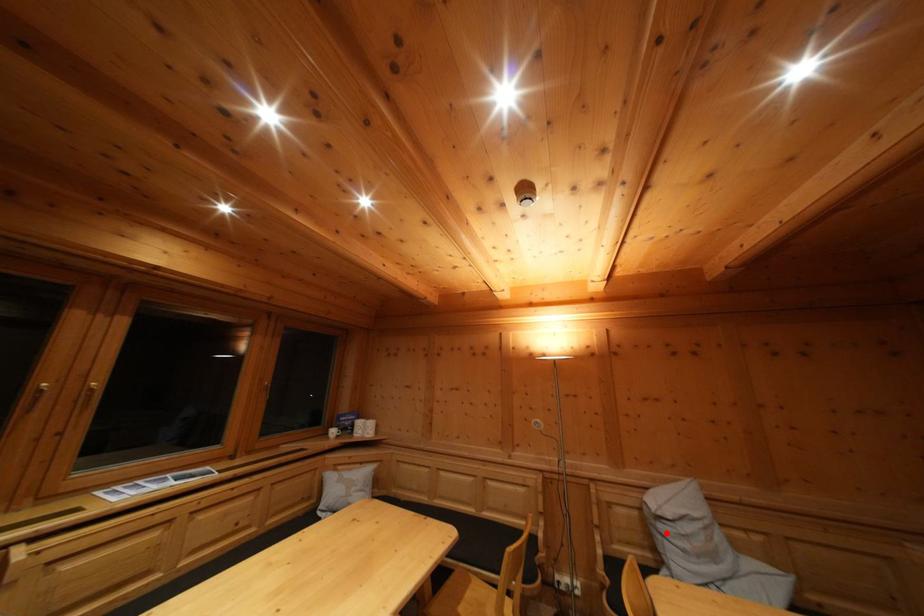
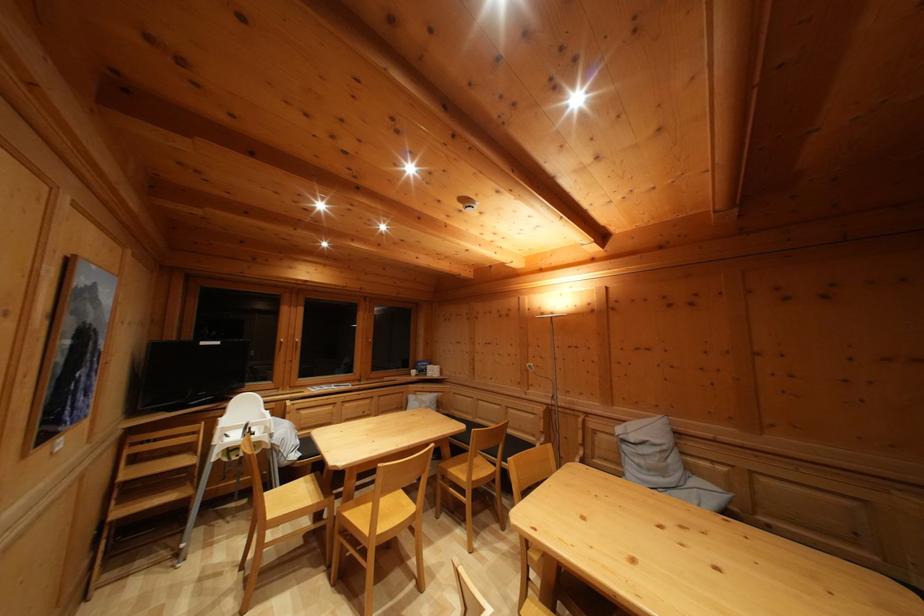
Question: I am providing you with two images of the same scene from different viewpoints. Image1 has a red point marked. In image2, the corresponding 3D location appears at what relative position? Reply with the corresponding letter.

Choices:
 (A) Closer
 (B) Farther

Answer: (B)